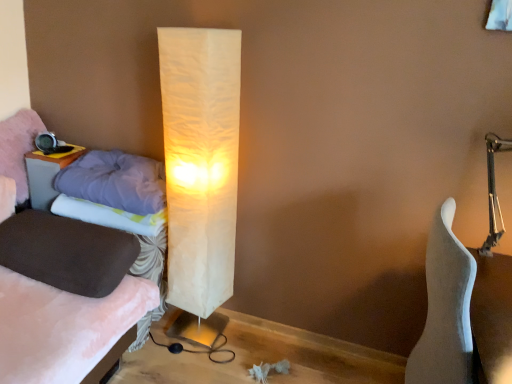
Where is `free space to the right of white paper lamp at center`? free space to the right of white paper lamp at center is located at coordinates [x=243, y=345].